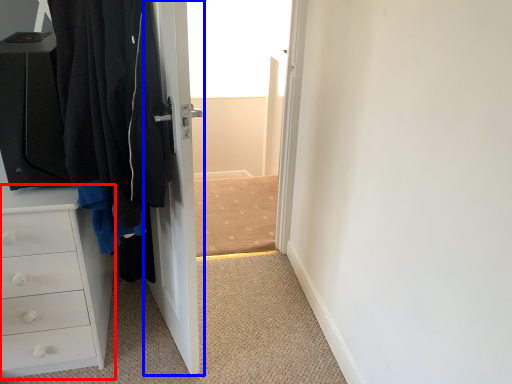
Question: Among these objects, which one is farthest to the camera, chest of drawers (highlighted by a red box) or door (highlighted by a blue box)?

Choices:
 (A) chest of drawers
 (B) door

Answer: (A)